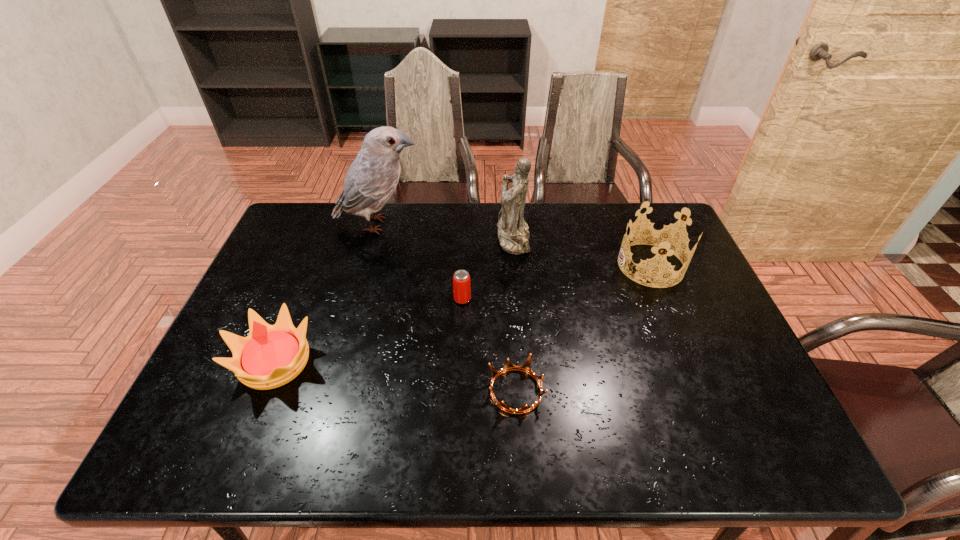
Where is `the tallest object`? The width and height of the screenshot is (960, 540). the tallest object is located at coordinates (371, 179).

You are a GUI agent. You are given a task and a screenshot of the screen. Output one action in this format:
    pyautogui.click(x=<x>, y=<y>)
    Task: Click on the figurine
    Image resolution: width=960 pixels, height=540 pixels.
    Given the screenshot: What is the action you would take?
    pyautogui.click(x=513, y=234)

What are the coordinates of `the rightmost crown` in the screenshot? It's located at (x=660, y=239).

Image resolution: width=960 pixels, height=540 pixels. I want to click on the rightmost object, so click(x=660, y=239).

At what (x,y) coordinates should I click in order to perform the action: click on the leftmost crown. Please return your answer as a coordinate pair (x, y). The height and width of the screenshot is (540, 960). Looking at the image, I should click on (270, 356).

Image resolution: width=960 pixels, height=540 pixels. In order to click on the fourth farthest object in this screenshot , I will do `click(461, 279)`.

Find the location of a particular element. the fourth object from right to left is located at coordinates pos(461,279).

At what (x,y) coordinates should I click in order to perform the action: click on the second crown from left to right. Please return your answer as a coordinate pair (x, y). Image resolution: width=960 pixels, height=540 pixels. Looking at the image, I should click on (526, 367).

The height and width of the screenshot is (540, 960). I want to click on the shortest crown, so click(x=526, y=367).

The height and width of the screenshot is (540, 960). I want to click on free spot located on the front-facing side of the tallest object, so click(486, 225).